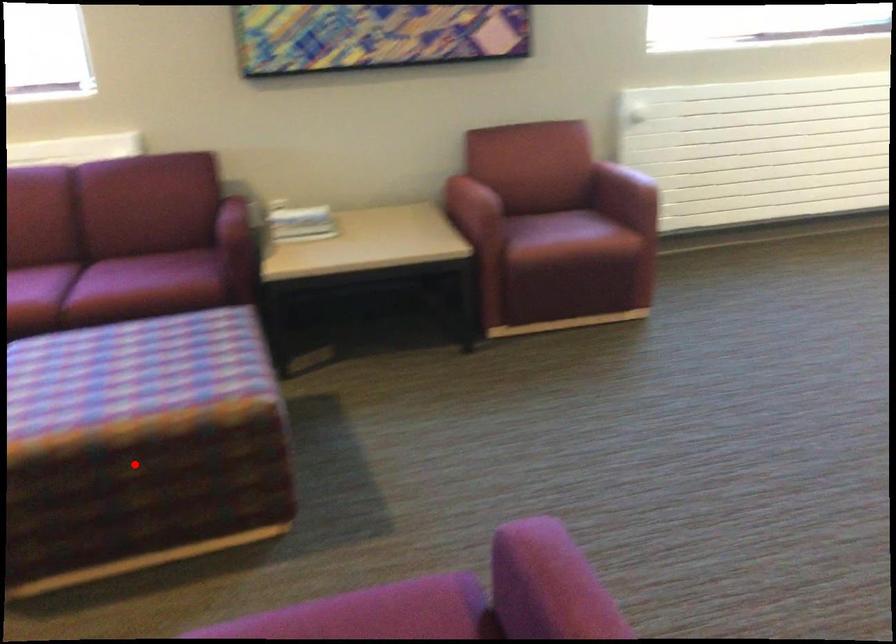
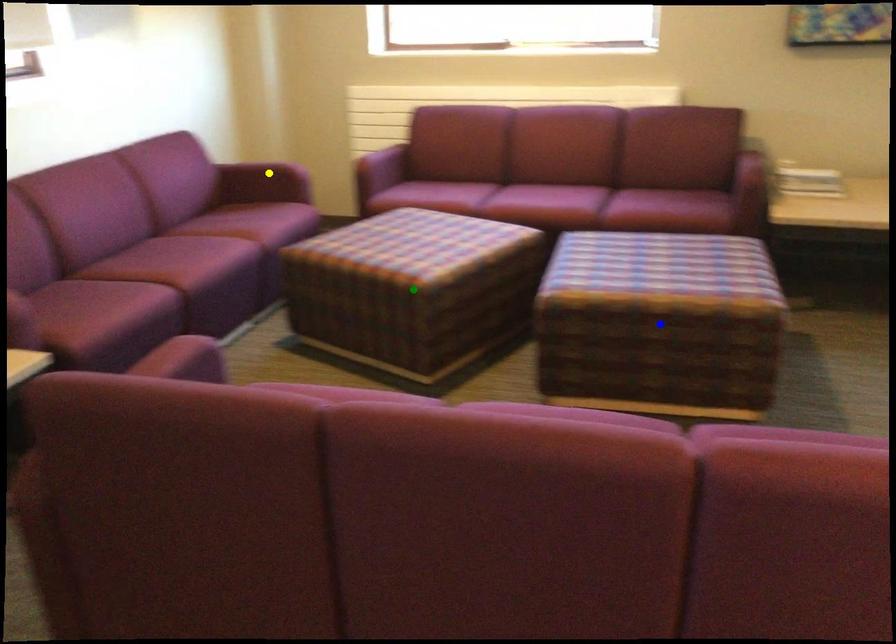
Question: I am providing you with two images of the same scene from different viewpoints. A red point is marked on the first image. You are given multiple points on the second image. Which spot in image 2 lines up with the point in image 1?

Choices:
 (A) blue point
 (B) yellow point
 (C) green point

Answer: (A)